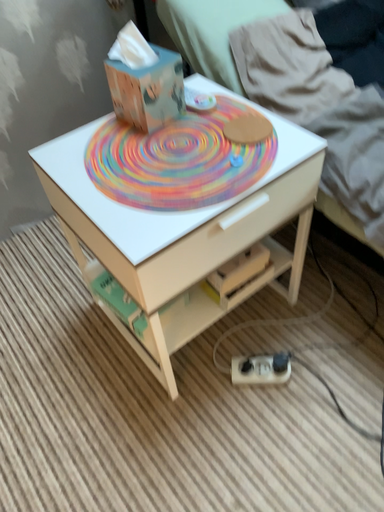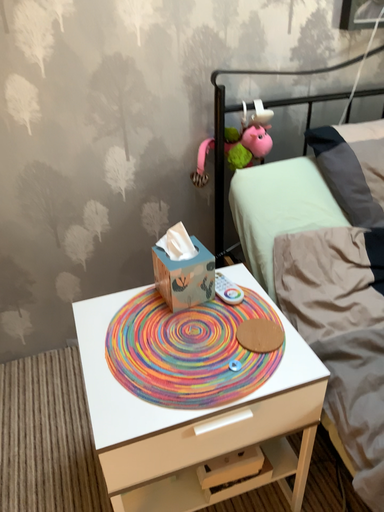
Question: Which way did the camera rotate in the video?

Choices:
 (A) rotated left
 (B) rotated right

Answer: (A)